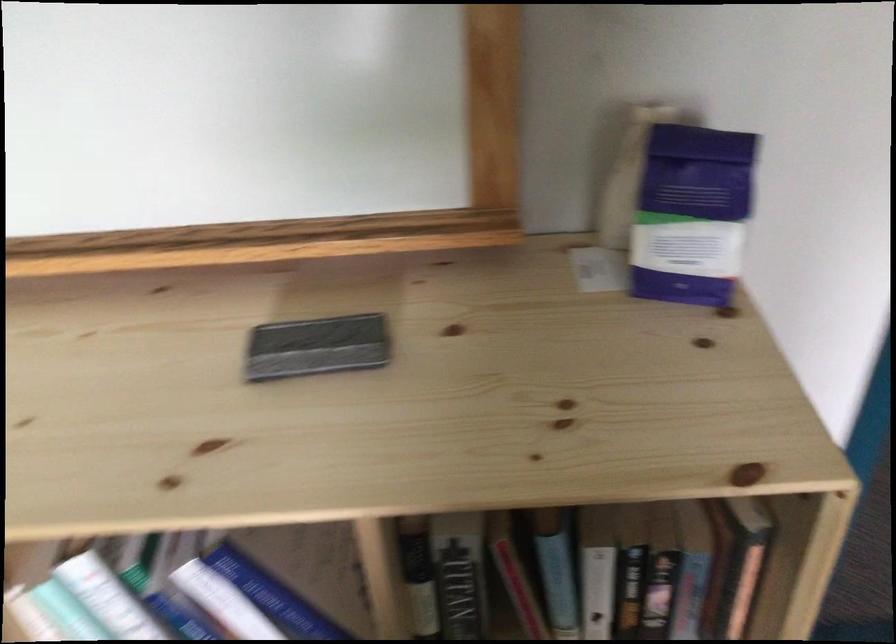
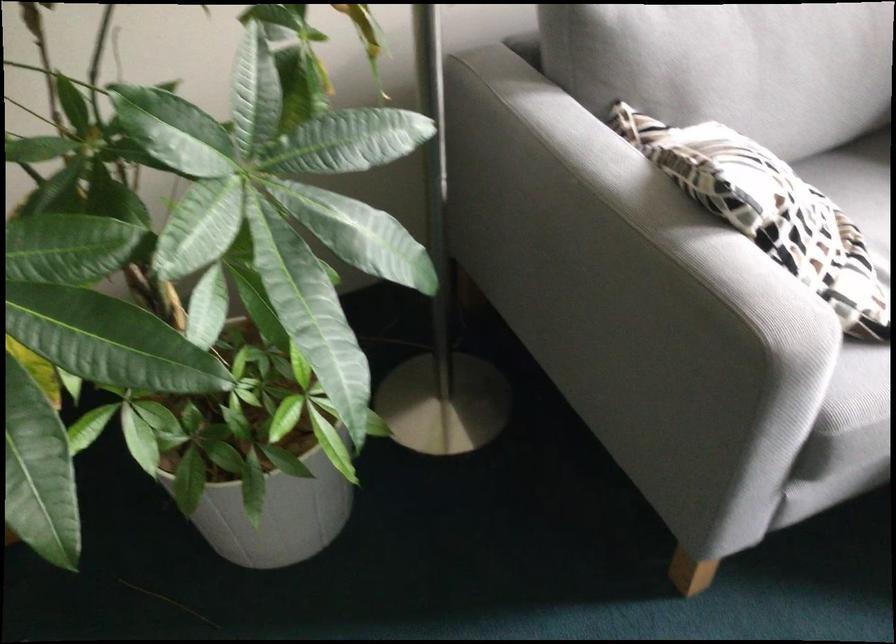
How did the camera likely rotate?

The rotation direction of the camera is right-down.